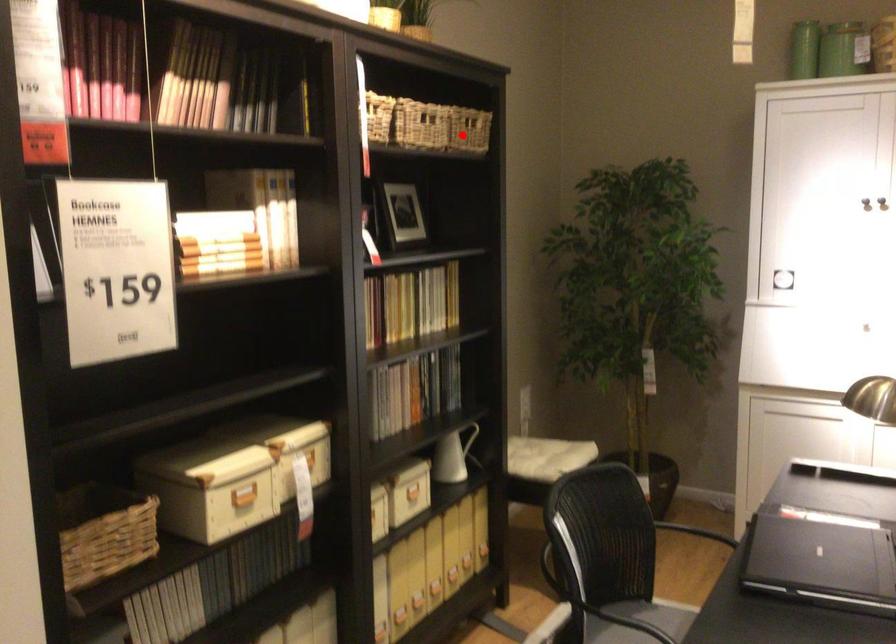
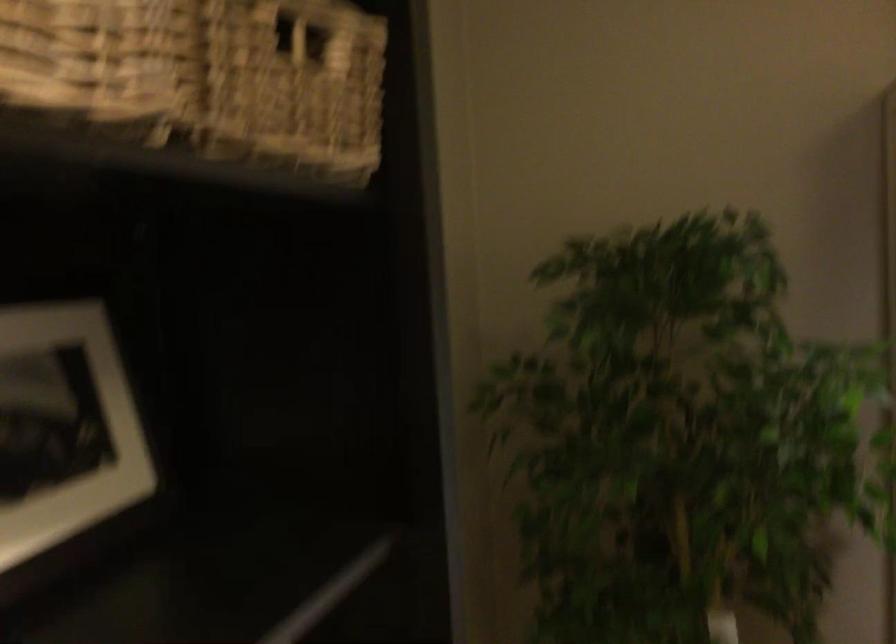
Question: I am providing you with two images of the same scene from different viewpoints. In image1, a red point is highlighted. Considering the same 3D point in image2, which of the following is correct?

Choices:
 (A) It is closer
 (B) It is farther

Answer: (A)